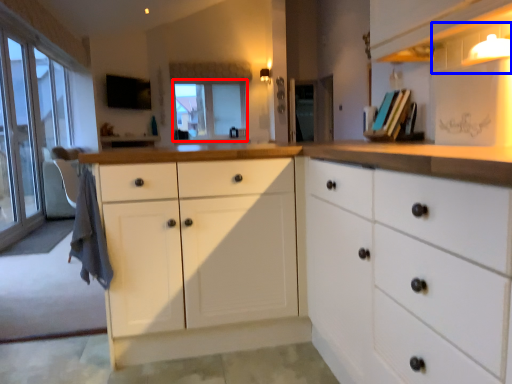
Question: Among these objects, which one is nearest to the camera, window screen (highlighted by a red box) or shelf (highlighted by a blue box)?

Choices:
 (A) window screen
 (B) shelf

Answer: (B)